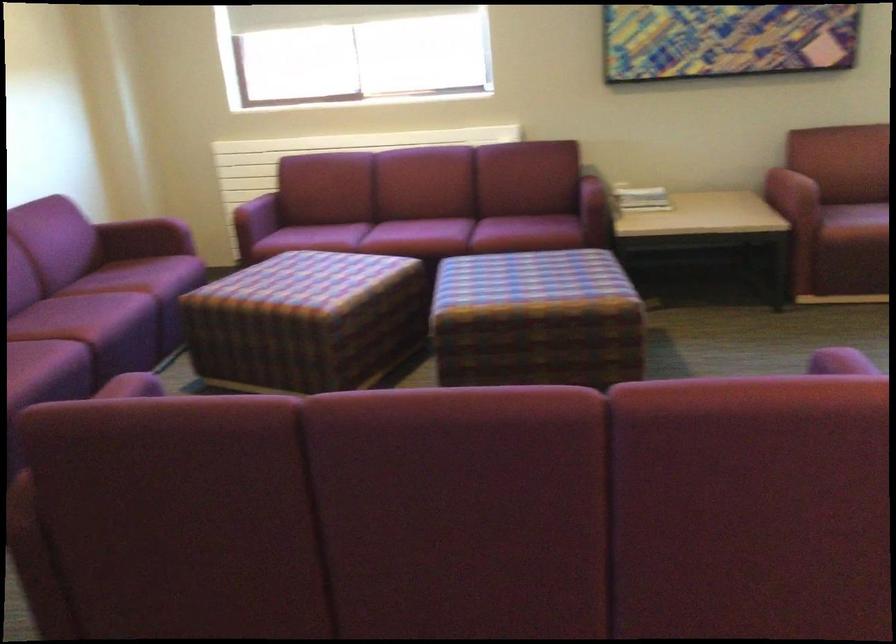
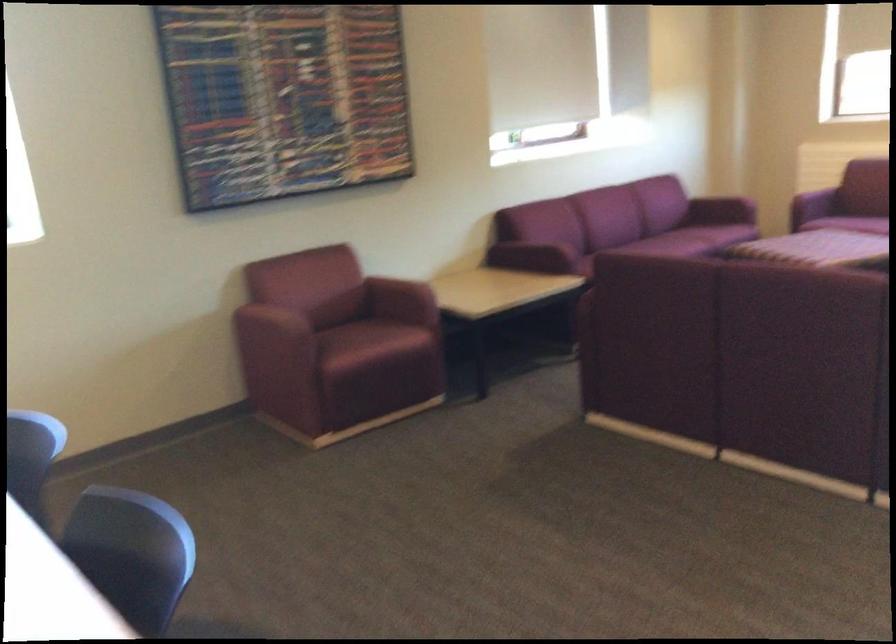
Question: I am providing you with two images of the same scene from different viewpoints. After the viewpoint changes to image2, which objects are now occluded?

Choices:
 (A) white and red mug
 (B) plaid ottoman surface
 (C) maroon chair armrest
 (D) maroon sofa armrest

Answer: (B)